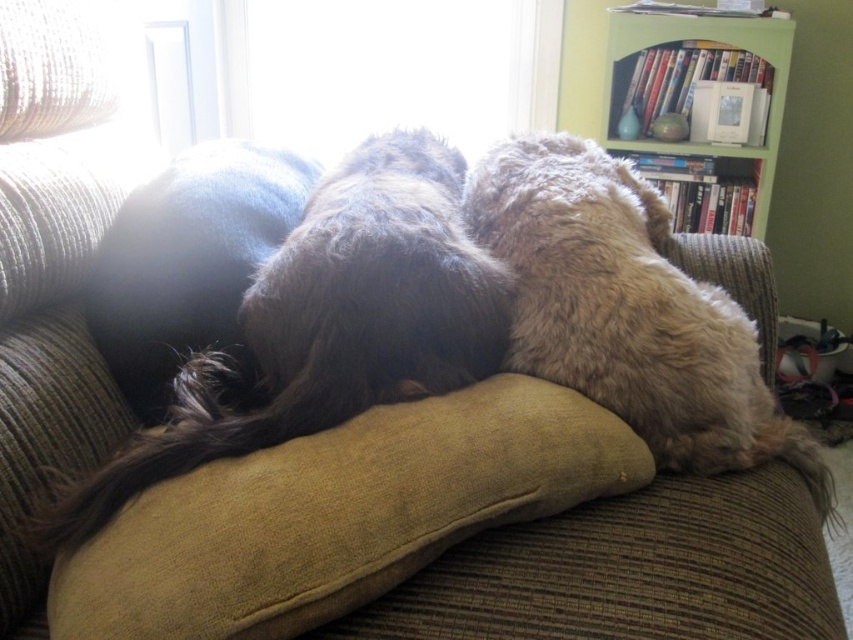
You are a guest in the house and want to take a photo of the fluffy brown dog at center through the transparent glass window at upper center. Is the dog positioned in a way that allows you to capture it clearly through the window?

The fluffy brown dog at center is in front of the transparent glass window at upper center, so it is blocking the view through the window. You won

You are looking at the couch in the image. There is a fluffy brown dog at center and a dark blue fabric at center. Which one is positioned to the right side?

The fluffy brown dog at center is to the right of the dark blue fabric at center.